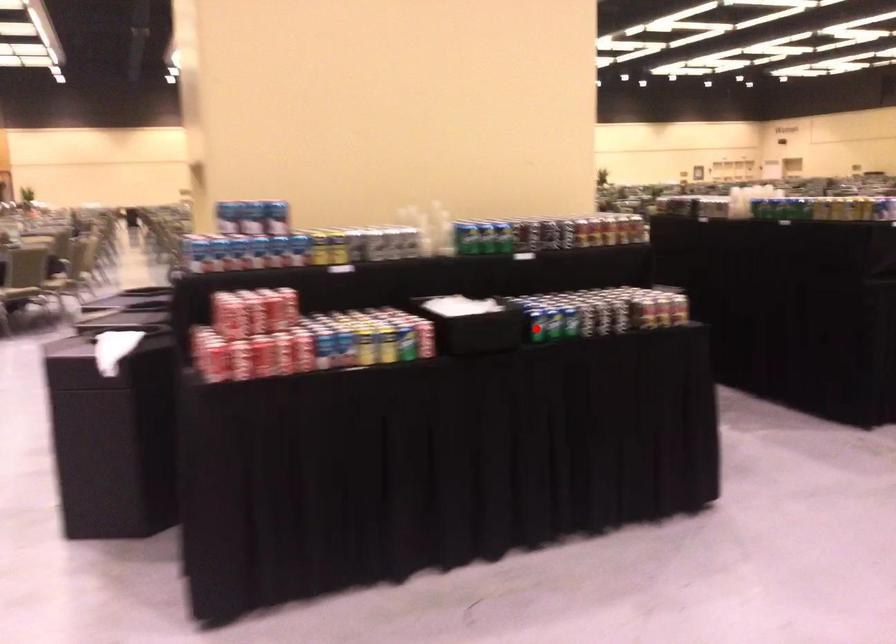
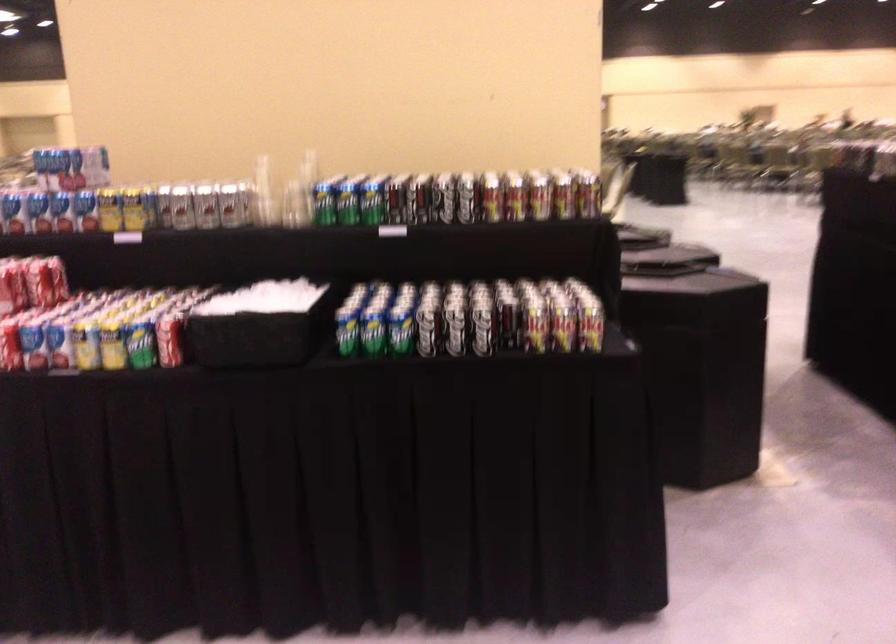
Question: I am providing you with two images of the same scene from different viewpoints. A red point is shown in image1. For the corresponding object point in image2, is it positioned nearer or farther from the camera?

Choices:
 (A) Nearer
 (B) Farther

Answer: (A)